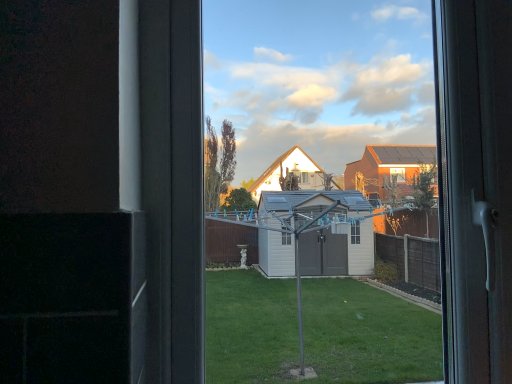
Where is `white plastic shed at center`? This screenshot has height=384, width=512. white plastic shed at center is located at coordinates (326, 86).

What do you see at coordinates (326, 86) in the screenshot? This screenshot has height=384, width=512. I see `white plastic shed at center` at bounding box center [326, 86].

Identify the location of white plastic shed at center. This screenshot has width=512, height=384. (326, 86).